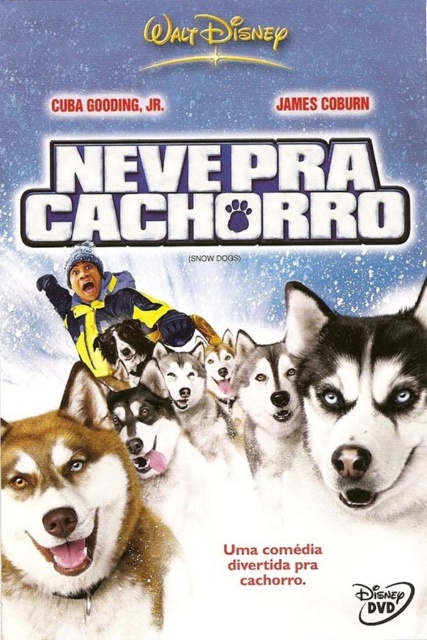
Is shiny brown fur at center to the left of sleek fur husky at center from the viewer's perspective?

Correct, you'll find shiny brown fur at center to the left of sleek fur husky at center.

Can you confirm if shiny brown fur at center is bigger than sleek fur husky at center?

Indeed, shiny brown fur at center has a larger size compared to sleek fur husky at center.

At what (x,y) coordinates should I click in order to perform the action: click on shiny brown fur at center. Please return your answer as a coordinate pair (x, y). This screenshot has height=640, width=427. Looking at the image, I should click on (81, 529).